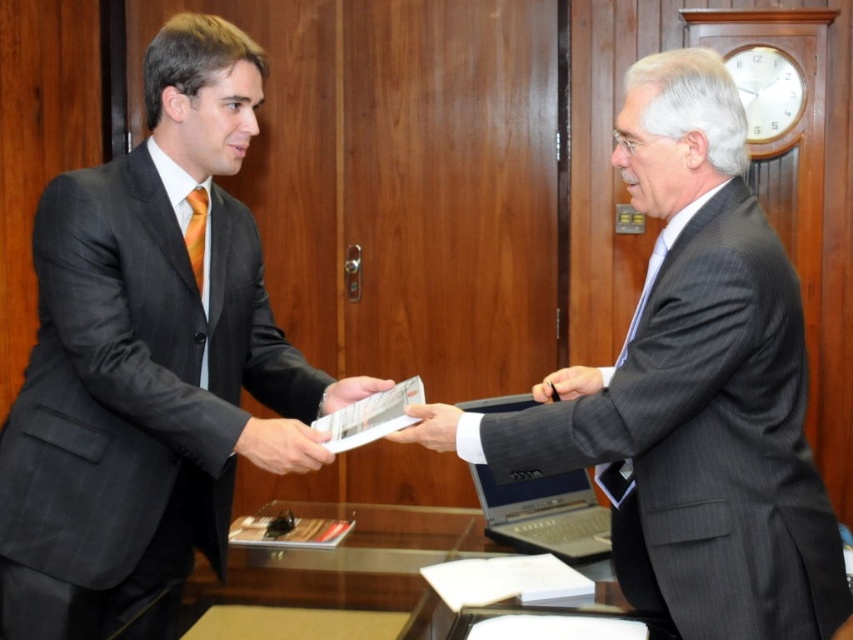
You are an observer in the office scene. You notice the matte black hand at center and the black leather pen at center. Which object is closer to you?

The matte black hand at center is closer to you than the black leather pen at center.

You are an observer in the office scene. You notice the matte black hand at center and the black leather pen at center. Which object is positioned to the left?

The matte black hand at center is positioned to the left of the black leather pen at center.

You are a security camera positioned 1.5 meters away from the scene. You need to capture a closeup of the matte black hand at center. Is your current distance sufficient to get a clear closeup?

The matte black hand at center is 1.30 meters away from the viewer. Since the security camera is positioned 1.5 meters away, it is slightly farther than the required distance. To capture a clear closeup, the camera would need to be moved closer to the hand to ensure it is within the optimal range for detailed imaging.